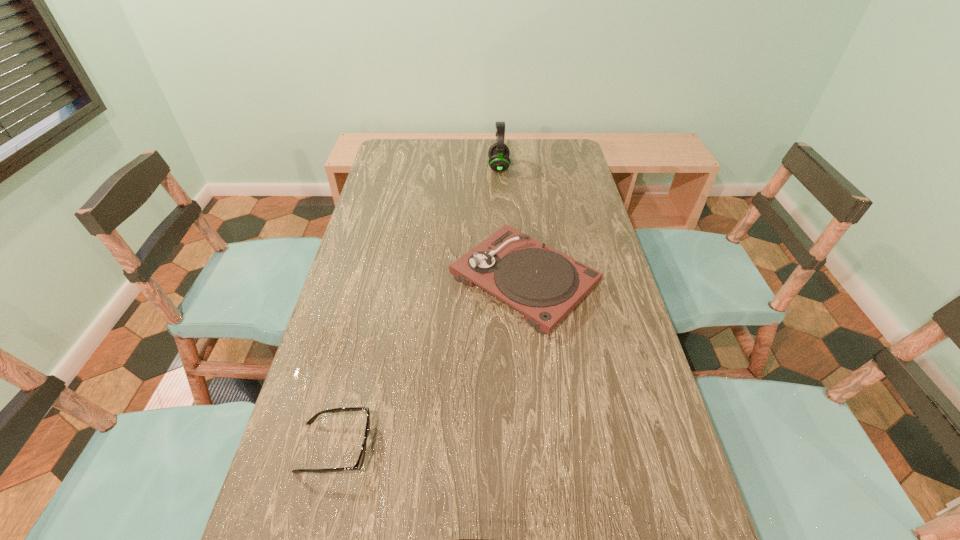
This screenshot has height=540, width=960. In order to click on vacant region between the third shortest object and the leftmost object in this screenshot , I will do `click(430, 363)`.

Identify the location of empty space between the farther spectacles and the farthest object. Image resolution: width=960 pixels, height=540 pixels. [x=417, y=307].

Locate an element on the screen. The height and width of the screenshot is (540, 960). vacant area that lies between the left spectacles and the phonograph_record is located at coordinates (430, 363).

Find the location of a particular element. free space between the left spectacles and the headset is located at coordinates (417, 307).

Where is `vacant space that's between the second farthest object and the tallest object`? vacant space that's between the second farthest object and the tallest object is located at coordinates [x=512, y=224].

The width and height of the screenshot is (960, 540). What are the coordinates of `the third closest object to the phonograph_record` in the screenshot? It's located at (459, 539).

Identify the location of the third closest object to the headset. This screenshot has width=960, height=540. (459, 539).

Identify the location of free location that satisfies the following two spatial constraints: 1. on the ear cups of the farthest object; 2. on the right side of the second farthest object. The image size is (960, 540). (506, 280).

Locate an element on the screen. The image size is (960, 540). vacant position in the image that satisfies the following two spatial constraints: 1. on the ear cups of the tallest object; 2. on the back side of the phonograph_record is located at coordinates 506,280.

At what (x,y) coordinates should I click in order to perform the action: click on vacant space that satisfies the following two spatial constraints: 1. on the ear cups of the second farthest object; 2. on the right side of the farthest object. Please return your answer as a coordinate pair (x, y). Image resolution: width=960 pixels, height=540 pixels. Looking at the image, I should click on (506, 280).